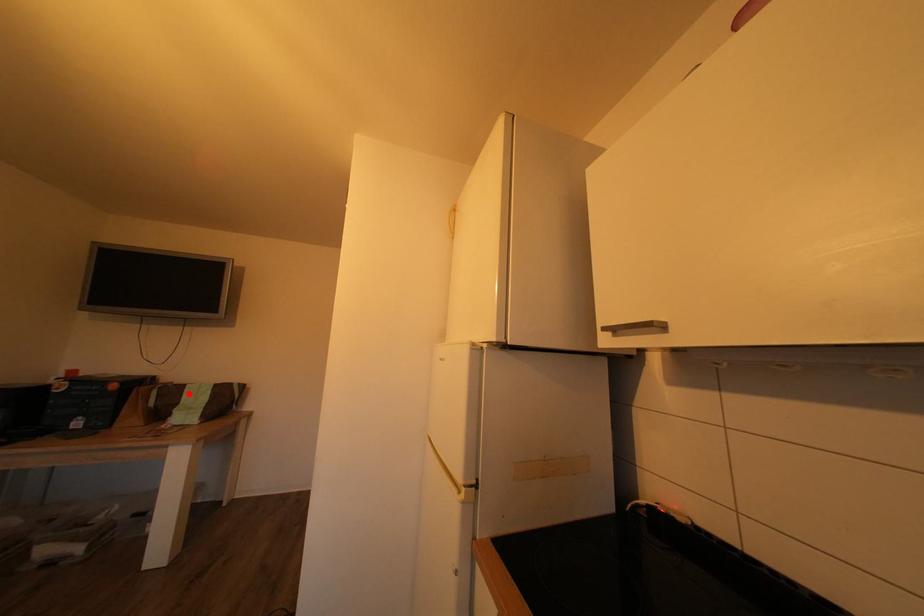
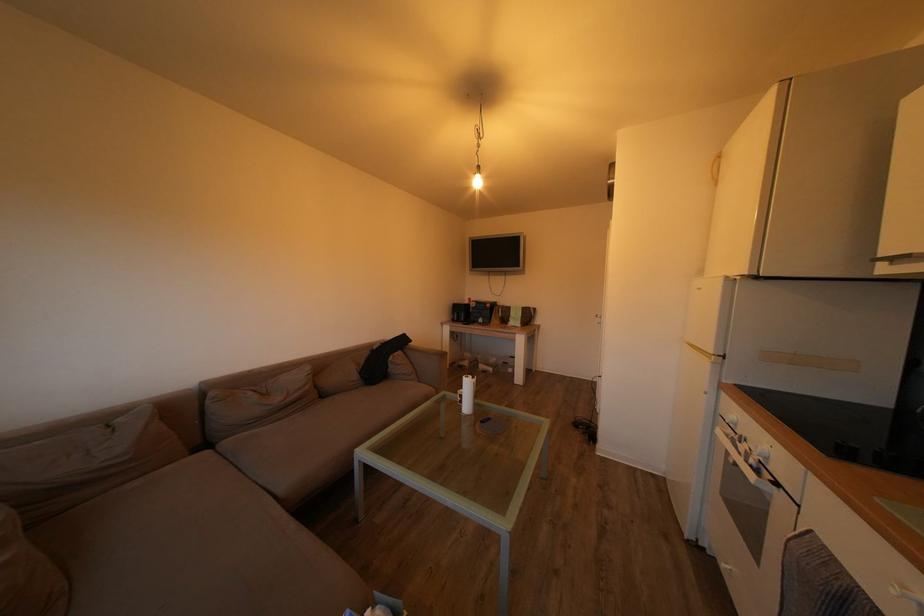
Find the pixel in the second image that matches the highlighted location in the first image.

(517, 314)